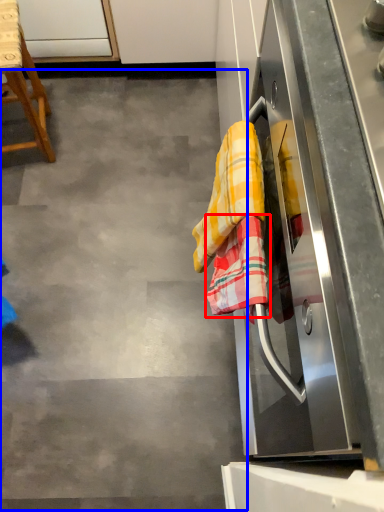
Question: Among these objects, which one is farthest to the camera, beach towel (highlighted by a red box) or concrete (highlighted by a blue box)?

Choices:
 (A) beach towel
 (B) concrete

Answer: (B)